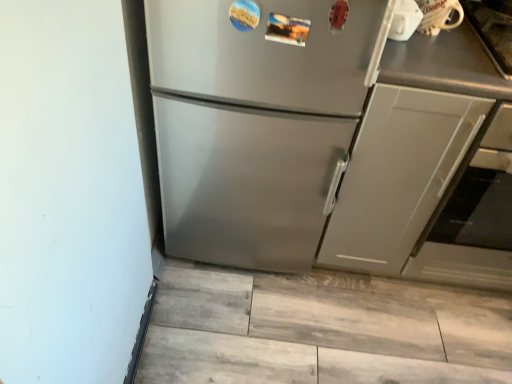
I want to click on satin gray oven at right, so click(x=473, y=216).

In order to click on satin silver refrigerator at center in this screenshot , I will do `click(258, 121)`.

Is white glossy mug at upper right bigger than satin silver refrigerator at center?

Incorrect, white glossy mug at upper right is not larger than satin silver refrigerator at center.

Which object is positioned more to the right, white glossy mug at upper right or satin silver refrigerator at center?

white glossy mug at upper right.

Is white glossy mug at upper right oriented away from satin silver refrigerator at center?

No, white glossy mug at upper right is not facing away from satin silver refrigerator at center.

Considering the positions of points (433, 24) and (456, 246), is point (433, 24) closer to camera compared to point (456, 246)?

Yes.

From a real-world perspective, relative to satin gray oven at right, is white glossy mug at upper right vertically above or below?

white glossy mug at upper right is above satin gray oven at right.

Is the position of white glossy mug at upper right more distant than that of satin gray oven at right?

Yes, white glossy mug at upper right is behind satin gray oven at right.

Is satin gray oven at right at the back of white glossy mug at upper right?

No.

Who is more distant, matte gray cabinet at right or satin gray oven at right?

satin gray oven at right is more distant.

Considering the relative sizes of matte gray cabinet at right and satin gray oven at right in the image provided, is matte gray cabinet at right shorter than satin gray oven at right?

No.

Which of these two, matte gray cabinet at right or satin gray oven at right, is thinner?

Thinner between the two is matte gray cabinet at right.

Considering the positions of points (223, 228) and (437, 4), is point (223, 228) closer to camera compared to point (437, 4)?

That is False.

Looking at this image, from the image's perspective, who appears lower, satin silver refrigerator at center or white glossy mug at upper right?

From the image's view, satin silver refrigerator at center is below.

Is satin silver refrigerator at center with white glossy mug at upper right?

No, satin silver refrigerator at center is not beside white glossy mug at upper right.

Which is more to the left, satin silver refrigerator at center or white glossy mug at upper right?

satin silver refrigerator at center.

From a real-world perspective, is matte gray cabinet at right above or below white glossy mug at upper right?

Clearly, from a real-world perspective, matte gray cabinet at right is below white glossy mug at upper right.

Where is `appliance on the right of matte gray cabinet at right`? appliance on the right of matte gray cabinet at right is located at coordinates (438, 15).

In the scene shown: From the image's perspective, is matte gray cabinet at right positioned above or below white glossy mug at upper right?

matte gray cabinet at right is situated lower than white glossy mug at upper right in the image.

Between satin gray oven at right and matte gray cabinet at right, which one has less height?

satin gray oven at right.

How many degrees apart are the facing directions of satin gray oven at right and matte gray cabinet at right?

The angular difference between satin gray oven at right and matte gray cabinet at right is 0.648 degrees.

Does satin gray oven at right have a smaller size compared to matte gray cabinet at right?

Incorrect, satin gray oven at right is not smaller in size than matte gray cabinet at right.

Between satin silver refrigerator at center and matte gray cabinet at right, which one has larger size?

satin silver refrigerator at center.

From the image's perspective, is satin silver refrigerator at center located above or below matte gray cabinet at right?

satin silver refrigerator at center is above matte gray cabinet at right.

Is matte gray cabinet at right located within satin silver refrigerator at center?

Definitely not — matte gray cabinet at right is not inside satin silver refrigerator at center.

Find the location of a particular element. The width and height of the screenshot is (512, 384). cabinetry behind the satin silver refrigerator at center is located at coordinates tap(398, 175).

Where is `appliance behind the satin silver refrigerator at center`? This screenshot has height=384, width=512. appliance behind the satin silver refrigerator at center is located at coordinates click(438, 15).

I want to click on appliance that appears above the satin gray oven at right (from the image's perspective), so click(x=438, y=15).

Looking at the image, which one is located further to satin silver refrigerator at center, matte gray cabinet at right or white glossy mug at upper right?

The object further to satin silver refrigerator at center is white glossy mug at upper right.

Which object lies nearer to the anchor point satin silver refrigerator at center, satin gray oven at right or matte gray cabinet at right?

matte gray cabinet at right is closer to satin silver refrigerator at center.

Estimate the real-world distances between objects in this image. Which object is further from white glossy mug at upper right, satin gray oven at right or matte gray cabinet at right?

satin gray oven at right.

Looking at the image, which one is located further to satin silver refrigerator at center, white glossy mug at upper right or matte gray cabinet at right?

white glossy mug at upper right is positioned further to the anchor satin silver refrigerator at center.

Considering their positions, is satin silver refrigerator at center positioned closer to satin gray oven at right than matte gray cabinet at right?

The object closer to satin gray oven at right is matte gray cabinet at right.

Looking at the image, which one is located closer to matte gray cabinet at right, satin silver refrigerator at center or white glossy mug at upper right?

satin silver refrigerator at center lies closer to matte gray cabinet at right than the other object.

Considering their positions, is satin silver refrigerator at center positioned further to matte gray cabinet at right than satin gray oven at right?

satin silver refrigerator at center is positioned further to the anchor matte gray cabinet at right.

Considering their positions, is matte gray cabinet at right positioned further to white glossy mug at upper right than satin silver refrigerator at center?

Based on the image, satin silver refrigerator at center appears to be further to white glossy mug at upper right.

The width and height of the screenshot is (512, 384). In order to click on cabinetry between satin silver refrigerator at center and satin gray oven at right in the horizontal direction in this screenshot , I will do `click(398, 175)`.

This screenshot has width=512, height=384. I want to click on appliance between matte gray cabinet at right and satin gray oven at right from left to right, so click(438, 15).

Where is `appliance located between satin silver refrigerator at center and satin gray oven at right in the left-right direction`? appliance located between satin silver refrigerator at center and satin gray oven at right in the left-right direction is located at coordinates (438, 15).

Locate an element on the screen. The image size is (512, 384). cabinetry between satin silver refrigerator at center and white glossy mug at upper right in the horizontal direction is located at coordinates (398, 175).